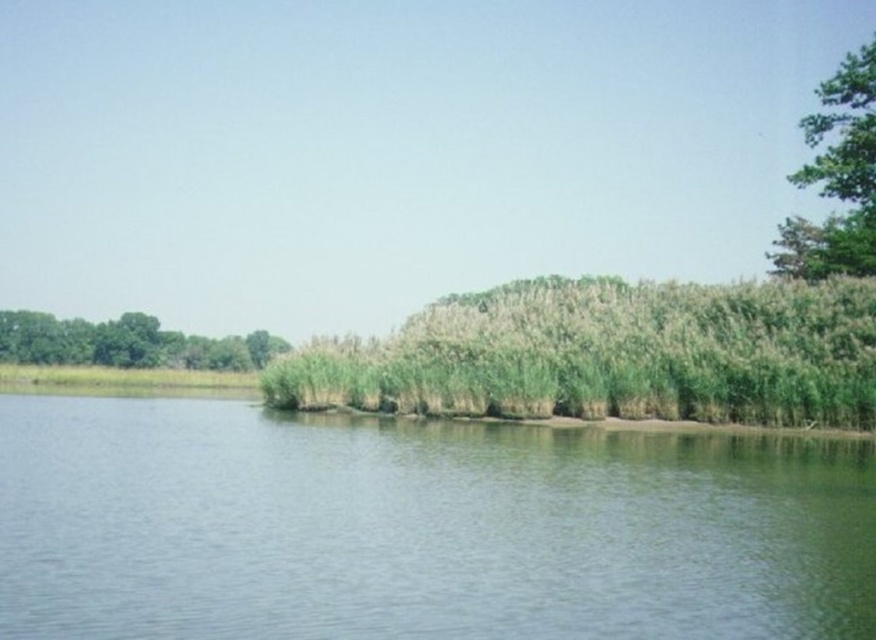
You are standing at the edge of the green grassy river at center and want to reach the green leafy trees at left. Which direction should you walk to get closer to the trees?

You should walk towards the left because the green leafy trees at left are located to the left side of the scene, so moving in that direction will bring you closer to them.